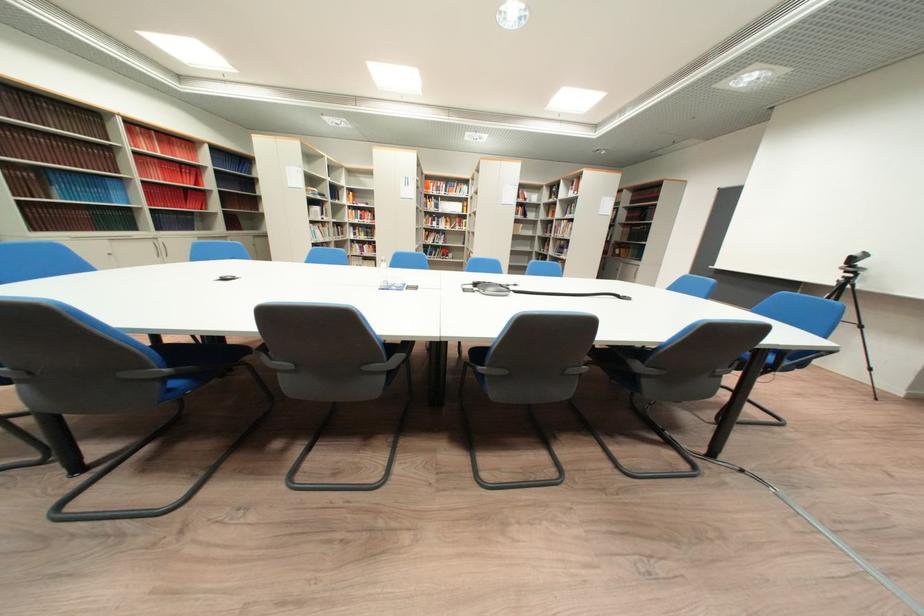
At what (x,y) coordinates should I click in order to perform the action: click on cabinet handle. Please return your answer as a coordinate pair (x, y). Looking at the image, I should click on (156, 251).